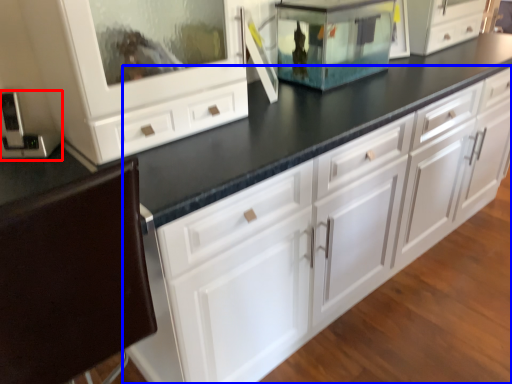
Question: Which object is further to the camera taking this photo, appliance (highlighted by a red box) or chest of drawers (highlighted by a blue box)?

Choices:
 (A) appliance
 (B) chest of drawers

Answer: (A)